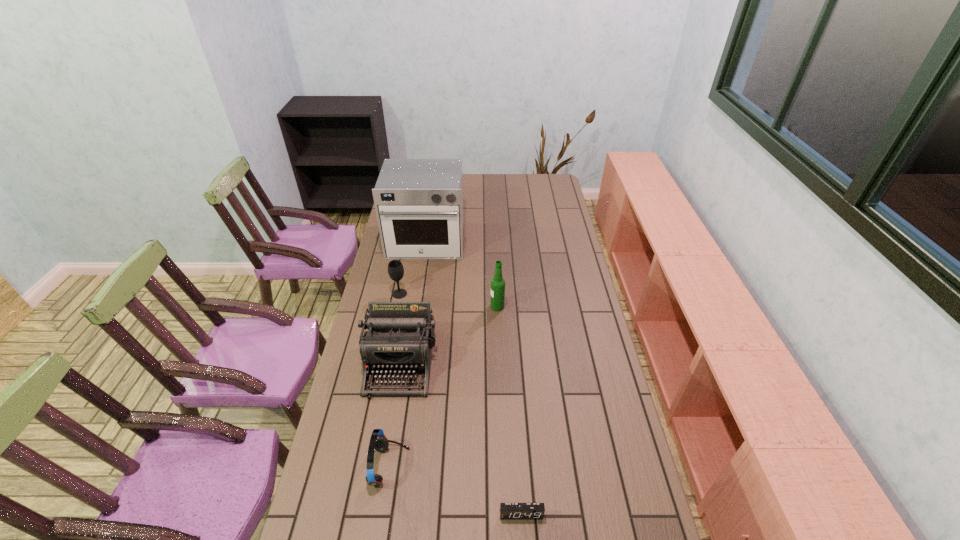
Find the location of `free area in between the fourth tallest object and the farthest object`. free area in between the fourth tallest object and the farthest object is located at coordinates (413, 268).

This screenshot has height=540, width=960. I want to click on free space between the third nearest object and the toaster oven, so click(414, 301).

In order to click on vacant area between the fifth farthest object and the shortest object in this screenshot , I will do `click(455, 490)`.

In order to click on vacant region between the alarm clock and the beer bottle in this screenshot , I will do `click(509, 410)`.

Select which object is the third closest to the fourth nearest object. Please provide its 2D coordinates. Your answer should be formatted as a tuple, i.e. [(x, y)], where the tuple contains the x and y coordinates of a point satisfying the conditions above.

[(395, 268)]

Locate an element on the screen. Image resolution: width=960 pixels, height=540 pixels. object that is the third nearest to the second nearest object is located at coordinates (497, 283).

At what (x,y) coordinates should I click in order to perform the action: click on free space that satisfies the following two spatial constraints: 1. on the front panel of the farthest object; 2. with the microphone attached to the side of the headset. Please return your answer as a coordinate pair (x, y). Image resolution: width=960 pixels, height=540 pixels. Looking at the image, I should click on (392, 467).